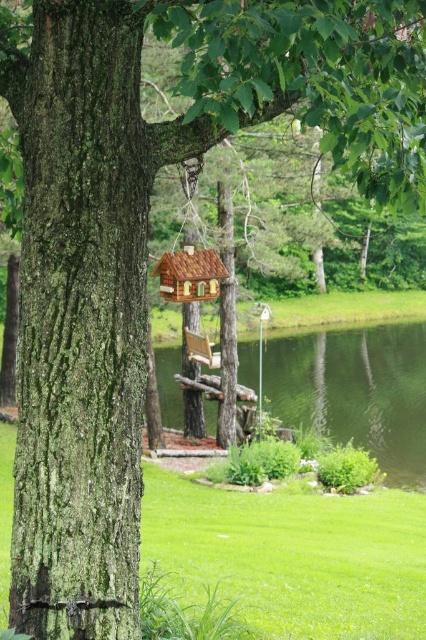
Which is above, green mossy bark at center or wooden swing at center?

green mossy bark at center

Between green mossy bark at center and wooden swing at center, which one appears on the left side from the viewer's perspective?

wooden swing at center is more to the left.

The image size is (426, 640). What do you see at coordinates (80, 323) in the screenshot?
I see `green mossy bark at center` at bounding box center [80, 323].

At what (x,y) coordinates should I click in order to perform the action: click on green mossy bark at center. Please return your answer as a coordinate pair (x, y). Looking at the image, I should click on (80, 323).

Is brown wooden bird feeder at center below wooden swing at center?

No.

Is point (170, 256) behind point (206, 356)?

No, (170, 256) is closer to viewer.

Does point (161, 278) lie behind point (198, 337)?

No, it is in front of (198, 337).

You are a GUI agent. You are given a task and a screenshot of the screen. Output one action in this format:
    pyautogui.click(x=<x>, y=<y>)
    Task: Click on the brown wooden bird feeder at center
    
    Given the screenshot: What is the action you would take?
    pyautogui.click(x=189, y=275)

Is green grassy lake at center below wooden swing at center?

Yes, green grassy lake at center is below wooden swing at center.

I want to click on green grassy lake at center, so click(x=356, y=390).

Image resolution: width=426 pixels, height=640 pixels. I want to click on green grassy lake at center, so click(x=356, y=390).